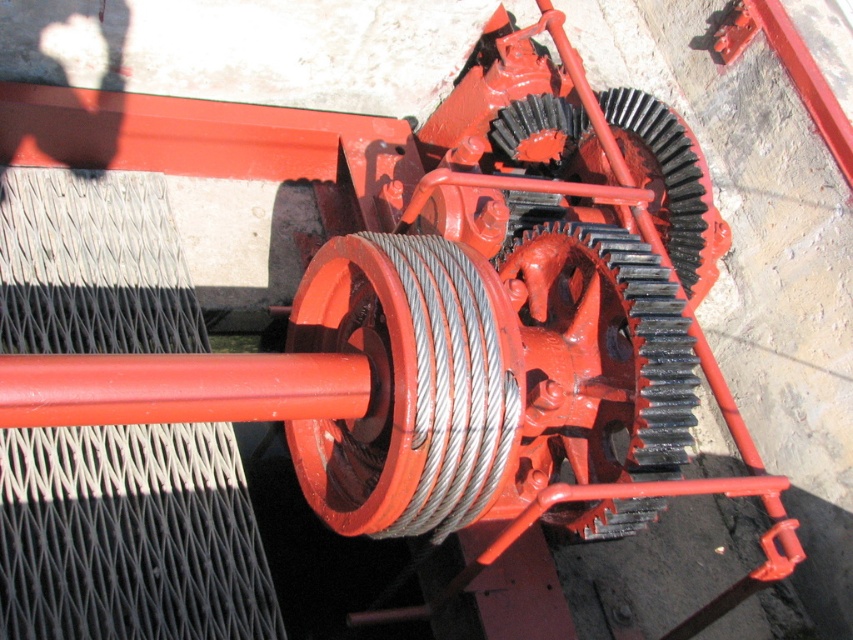
Between point (444, 464) and point (604, 515), which one is positioned in front?

Point (444, 464)

Who is higher up, matte orange pulley at center or metallic wire at center?

metallic wire at center is higher up.

Between point (347, 280) and point (683, 376), which one is positioned behind?

The point (347, 280) is behind.

Image resolution: width=853 pixels, height=640 pixels. Identify the location of matte orange pulley at center. (407, 385).